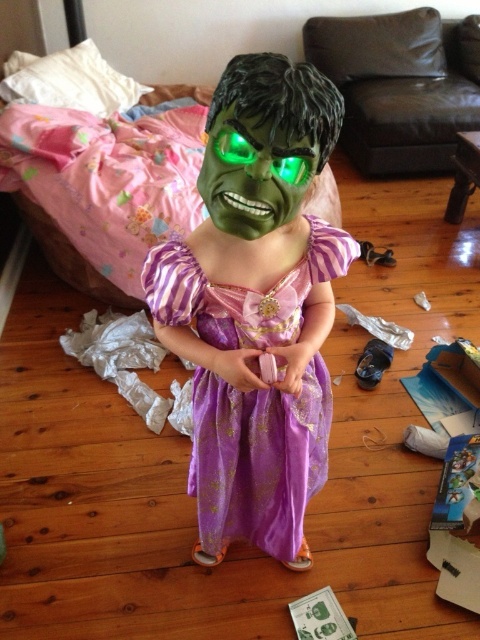
Consider the image. You are a photographer taking a picture of the purple satin dress at center and the green matte mask at center. Which object is closer to your camera lens?

The purple satin dress at center is closer to the camera lens because it is positioned further to the viewer than the green matte mask at center.

You are a photographer setting up a shoot in this room. You want to place a small stool between the purple satin dress at center and the green matte mask at center. Based on their positions, will the stool fit between them?

The purple satin dress at center is positioned on the left side of green matte mask at center, so there is space between them. The stool should fit between them as long as it is narrower than the distance between the two objects.